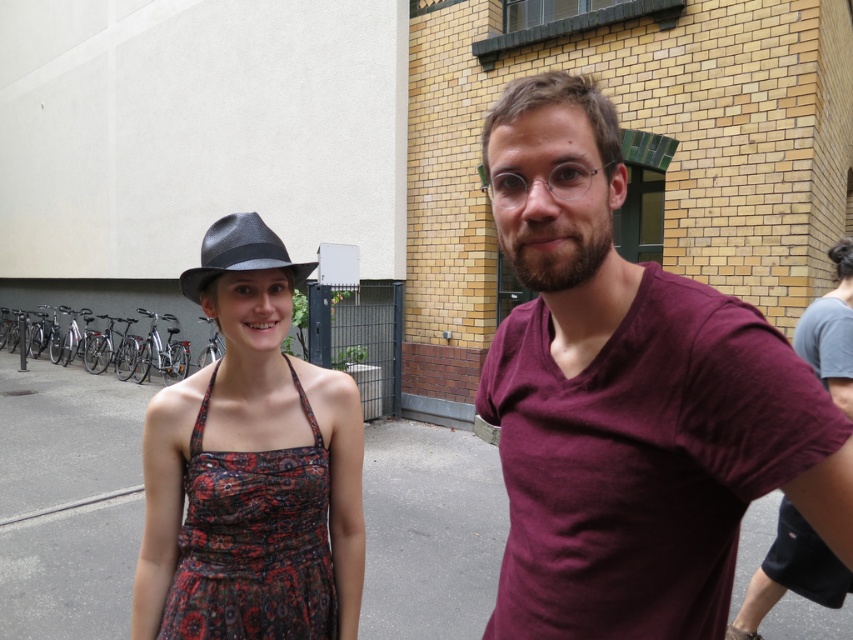
Who is positioned more to the left, maroon cotton t-shirt at right or printed fabric dress at center?

printed fabric dress at center

Does maroon cotton t-shirt at right have a lesser width compared to printed fabric dress at center?

No, maroon cotton t-shirt at right is not thinner than printed fabric dress at center.

Who is more forward, (589, 145) or (192, 572)?

Positioned in front is point (589, 145).

The image size is (853, 640). In order to click on maroon cotton t-shirt at right in this screenshot , I will do `click(630, 400)`.

Can you confirm if printed fabric dress at center is positioned to the right of matte black fedora at center?

Correct, you'll find printed fabric dress at center to the right of matte black fedora at center.

Between point (201, 445) and point (221, 262), which one is positioned in front?

Point (221, 262) is in front.

Where is `printed fabric dress at center`? printed fabric dress at center is located at coordinates (253, 541).

Between maroon cotton t-shirt at right and matte black fedora at center, which one appears on the right side from the viewer's perspective?

maroon cotton t-shirt at right is more to the right.

Is maroon cotton t-shirt at right positioned at the back of matte black fedora at center?

That is False.

This screenshot has width=853, height=640. What are the coordinates of `maroon cotton t-shirt at right` in the screenshot? It's located at (630, 400).

Locate an element on the screen. This screenshot has width=853, height=640. maroon cotton t-shirt at right is located at coordinates (630, 400).